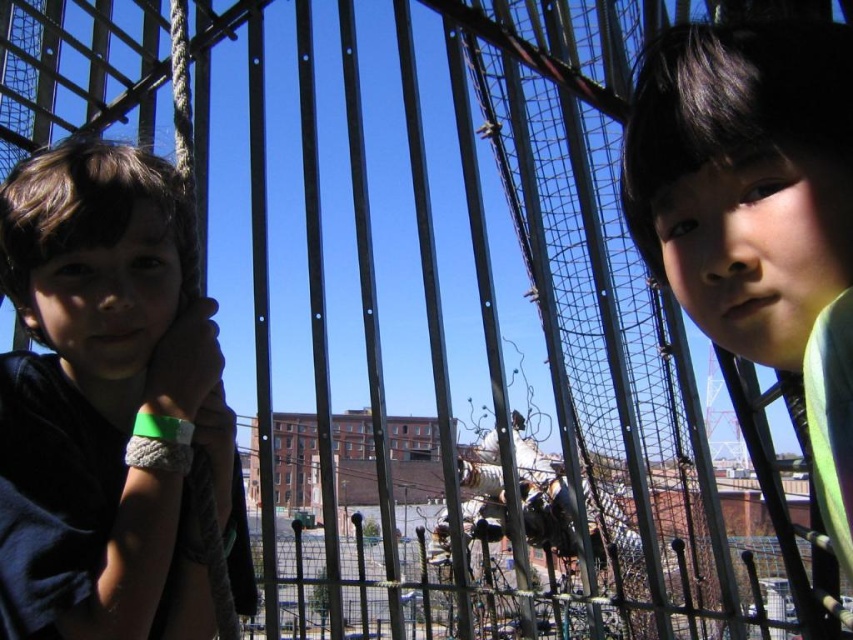
Question: Does dark brown hair at left appear over smooth green shirt at right?

Choices:
 (A) yes
 (B) no

Answer: (B)

Question: Does dark brown hair at left have a lesser width compared to smooth green shirt at right?

Choices:
 (A) no
 (B) yes

Answer: (A)

Question: Which point appears farthest from the camera in this image?

Choices:
 (A) (740, 122)
 (B) (3, 460)

Answer: (B)

Question: Does dark brown hair at left appear under smooth green shirt at right?

Choices:
 (A) yes
 (B) no

Answer: (A)

Question: Which of the following is the closest to the observer?

Choices:
 (A) smooth green shirt at right
 (B) dark brown hair at left

Answer: (A)